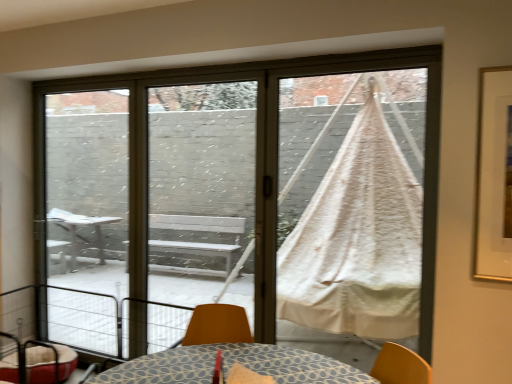
Identify the location of free space above transparent glass screen door at left, acting as the first screen door starting from the left (from a real-world perspective). The height and width of the screenshot is (384, 512). (94, 78).